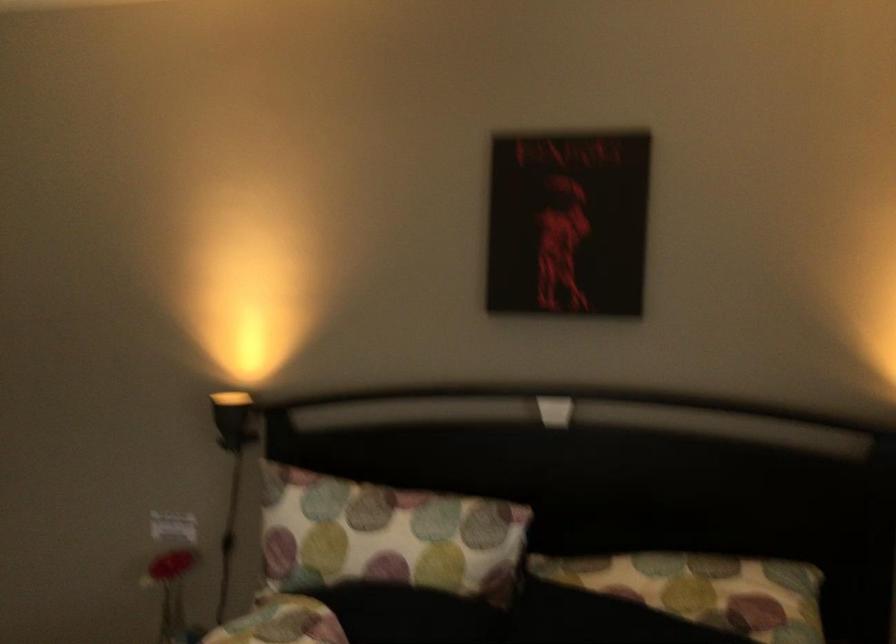
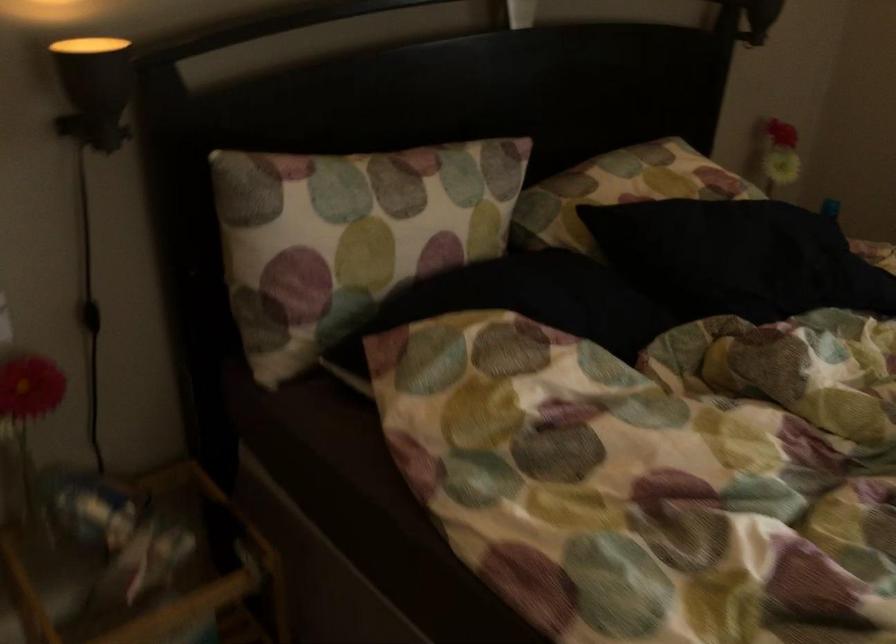
In the second image, find the point that corresponds to point 235,538 in the first image.

(90, 316)